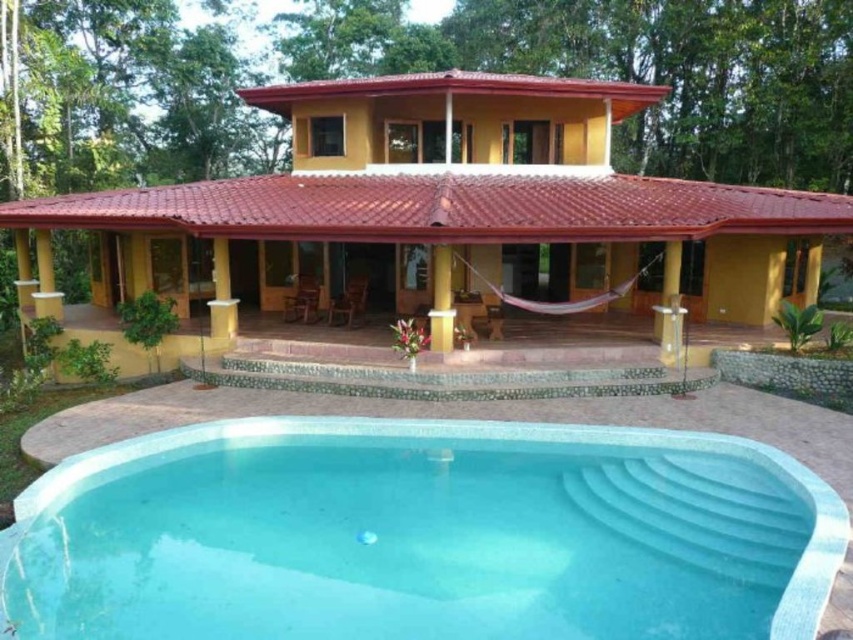
Who is shorter, smooth concrete pool at lower center or purple fabric hammock at center?

With less height is smooth concrete pool at lower center.

Does point (355, 604) come in front of point (618, 289)?

Yes, it is.

Find the location of a particular element. The image size is (853, 640). smooth concrete pool at lower center is located at coordinates (453, 529).

Can you confirm if smooth concrete pool at lower center is positioned to the right of yellow wood pillar at center?

Correct, you'll find smooth concrete pool at lower center to the right of yellow wood pillar at center.

Is smooth concrete pool at lower center positioned in front of yellow wood pillar at center?

Yes, smooth concrete pool at lower center is in front of yellow wood pillar at center.

Is point (210, 584) positioned after point (434, 289)?

No, it is in front of (434, 289).

At what (x,y) coordinates should I click in order to perform the action: click on smooth concrete pool at lower center. Please return your answer as a coordinate pair (x, y). The width and height of the screenshot is (853, 640). Looking at the image, I should click on (453, 529).

Does purple fabric hammock at center appear under yellow wood pillar at center?

Yes, purple fabric hammock at center is below yellow wood pillar at center.

Is point (497, 292) less distant than point (428, 308)?

Yes, it is in front of point (428, 308).

This screenshot has width=853, height=640. Find the location of `purple fabric hammock at center`. purple fabric hammock at center is located at coordinates (561, 301).